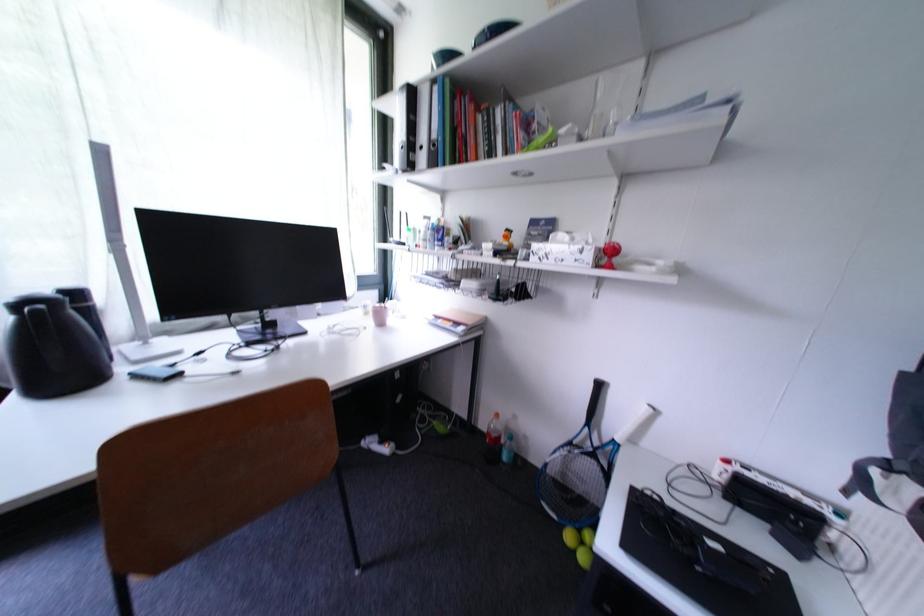
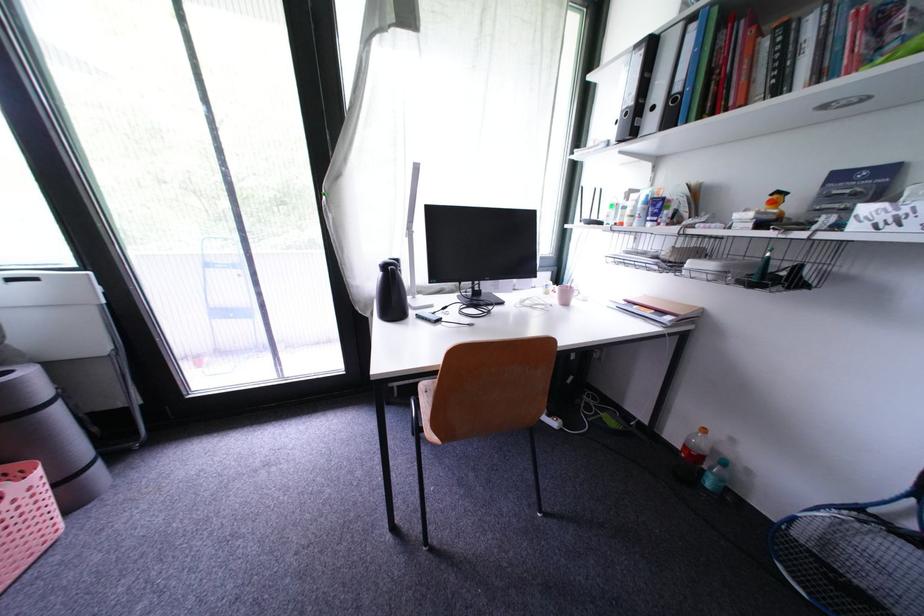
Where in the second image is the point corresponding to pixel 478 325 from the first image?

(689, 315)